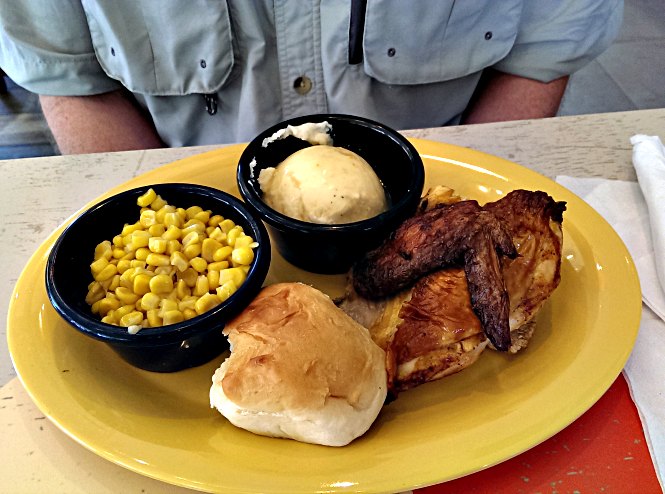
Where is `yellow plate`? The height and width of the screenshot is (494, 665). yellow plate is located at coordinates (545, 383).